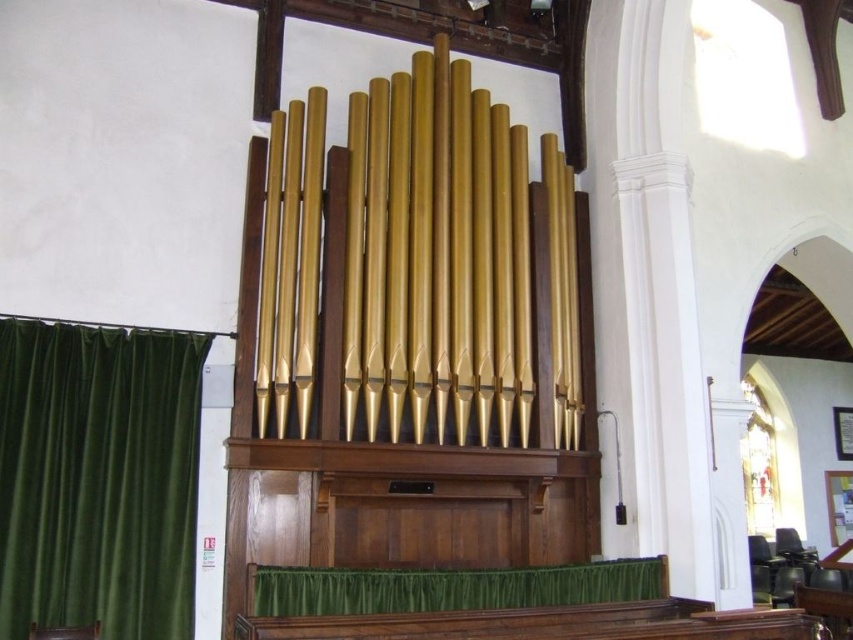
Question: Which point is farther to the camera?

Choices:
 (A) gold polished pipes at center
 (B) green satin curtain at lower center
 (C) velvet green curtain at left

Answer: (A)

Question: Which object is the closest to the velvet green curtain at left?

Choices:
 (A) green satin curtain at lower center
 (B) gold polished pipes at center

Answer: (A)

Question: Is gold polished pipes at center closer to camera compared to green satin curtain at lower center?

Choices:
 (A) yes
 (B) no

Answer: (B)

Question: Is gold polished pipes at center to the right of velvet green curtain at left from the viewer's perspective?

Choices:
 (A) no
 (B) yes

Answer: (B)

Question: Which point is farther to the camera?

Choices:
 (A) green satin curtain at lower center
 (B) gold polished pipes at center
 (C) velvet green curtain at left

Answer: (B)

Question: Is gold polished pipes at center positioned at the back of green satin curtain at lower center?

Choices:
 (A) yes
 (B) no

Answer: (A)